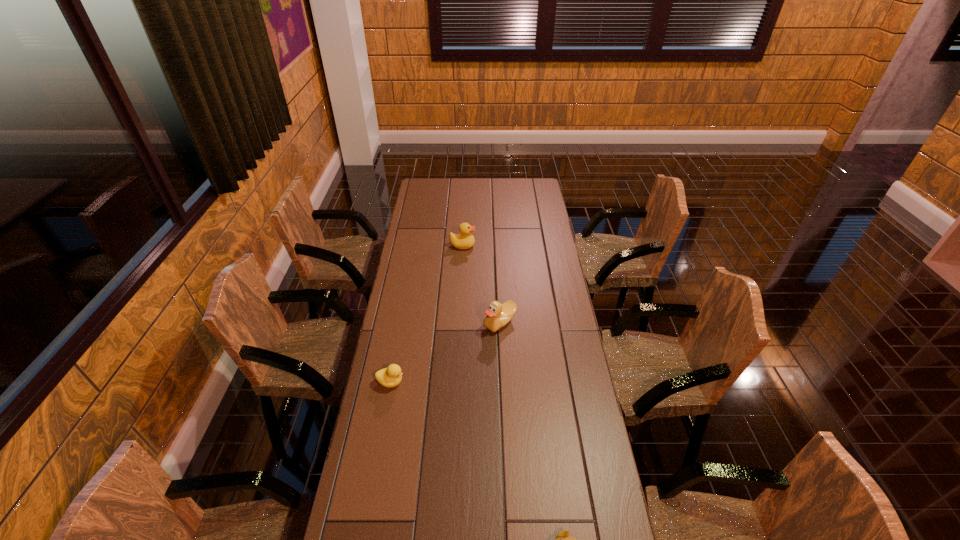
This screenshot has width=960, height=540. In order to click on free space that is in between the third farthest object and the second farthest duck in this screenshot , I will do `click(445, 353)`.

Identify the location of the second closest object to the duckling. This screenshot has height=540, width=960. 498,315.

Locate which object is the third closest to the third object from right to left. Please provide its 2D coordinates. Your answer should be formatted as a tuple, i.e. [(x, y)], where the tuple contains the x and y coordinates of a point satisfying the conditions above.

[(563, 539)]

This screenshot has height=540, width=960. Identify the location of the closest duck to the nearest object. (391, 376).

Where is `the closest duck to the nearest duck`? the closest duck to the nearest duck is located at coordinates (498, 315).